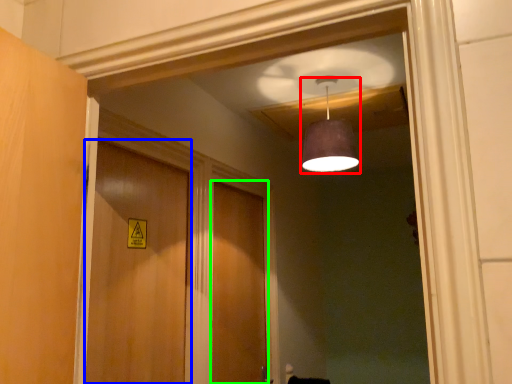
Question: Considering the real-world distances, which object is farthest from light fixture (highlighted by a red box)? door (highlighted by a blue box) or door (highlighted by a green box)?

Choices:
 (A) door
 (B) door

Answer: (B)